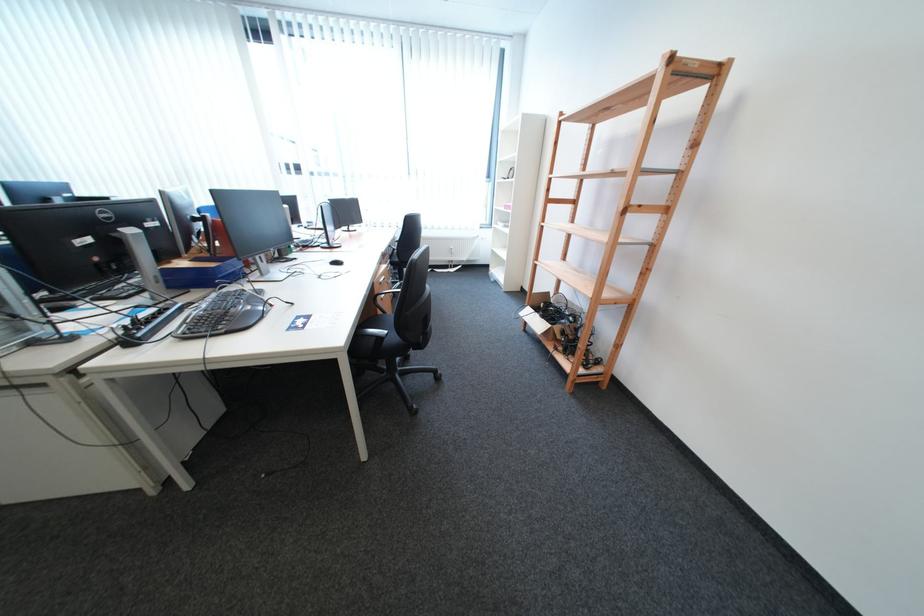
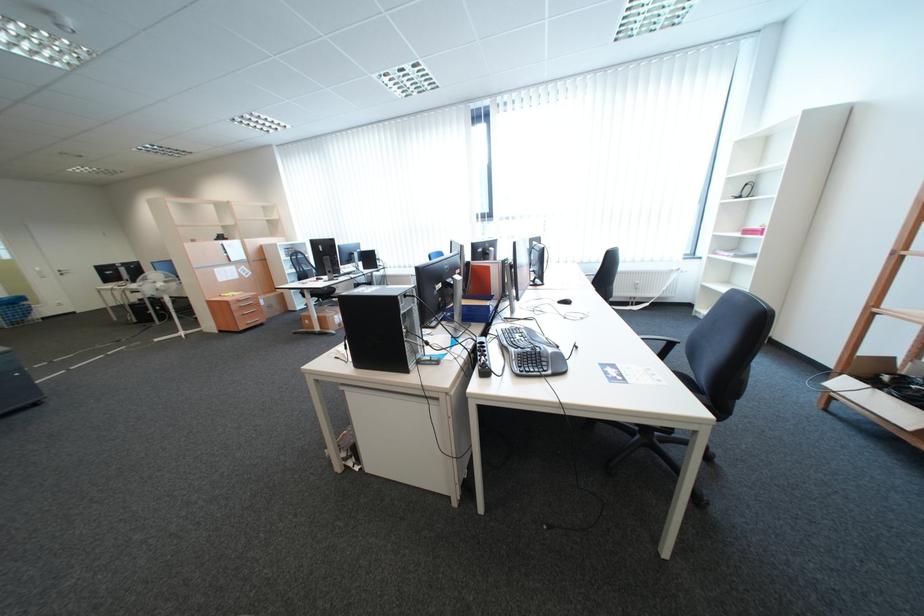
Question: What movement of the cameraman would produce the second image?

Choices:
 (A) Left
 (B) Right
 (C) Forward
 (D) Backward

Answer: (A)